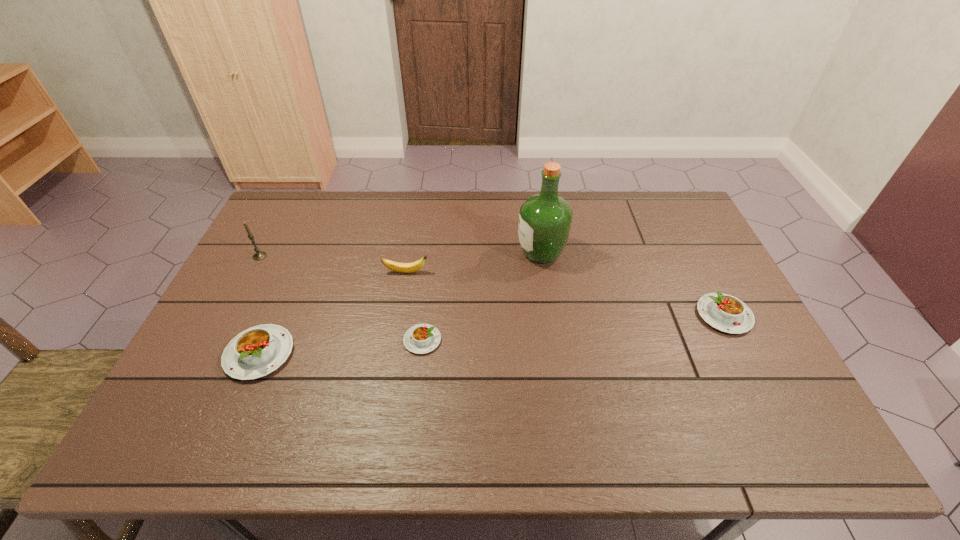
Identify the location of vacant space that's between the leftmost pudding and the rightmost object. (492, 334).

What are the coordinates of `vacant space in between the candle and the tallest object` in the screenshot? It's located at (400, 254).

Identify the location of free space between the fourth nearest object and the tallest object. This screenshot has width=960, height=540. (473, 262).

The image size is (960, 540). Identify the location of vacant point located between the fifth object from right to left and the second object from right to left. (400, 303).

You are a GUI agent. You are given a task and a screenshot of the screen. Output one action in this format:
    pyautogui.click(x=<x>, y=<y>)
    Task: Click on the unoccupied area between the liquor and the candle
    Image resolution: width=960 pixels, height=540 pixels.
    Given the screenshot: What is the action you would take?
    pyautogui.click(x=400, y=254)

Where is `free space between the second shortest pudding and the shortest object`? This screenshot has width=960, height=540. free space between the second shortest pudding and the shortest object is located at coordinates (573, 328).

Identify the location of blank region between the leftmost object and the second shortest pudding. (492, 286).

In order to click on empty space between the second object from left to right and the shortest pudding in this screenshot , I will do `click(341, 347)`.

You are a GUI agent. You are given a task and a screenshot of the screen. Output one action in this format:
    pyautogui.click(x=<x>, y=<y>)
    Task: Click on the object that ranks as the fourth closest to the rightmost pudding
    This screenshot has height=540, width=960.
    Given the screenshot: What is the action you would take?
    pyautogui.click(x=256, y=352)

I want to click on object that is the fifth closest to the banana, so pos(726,313).